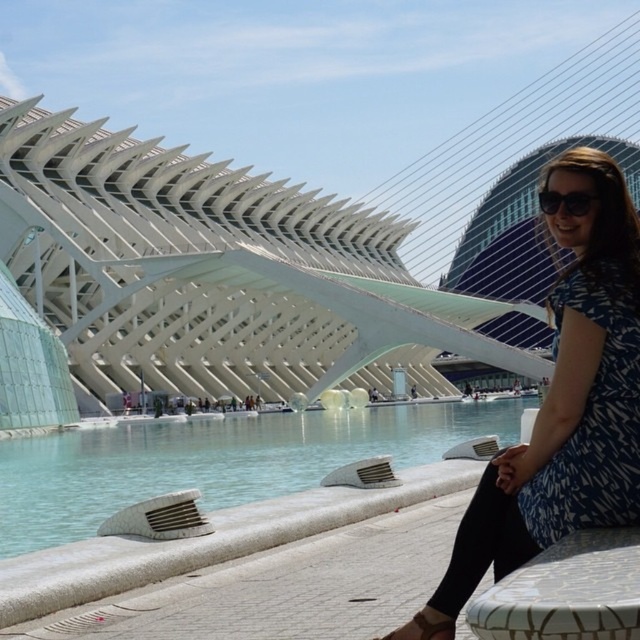
Question: Is blue printed dress at center smaller than brown leather sandal at lower center?

Choices:
 (A) yes
 (B) no

Answer: (B)

Question: Which object appears closest to the camera in this image?

Choices:
 (A) brown leather sandal at lower center
 (B) white textured ledge at lower center

Answer: (A)

Question: Can you confirm if white textured ledge at lower center is wider than brown leather sandal at lower center?

Choices:
 (A) no
 (B) yes

Answer: (B)

Question: Which point is farther to the camera?

Choices:
 (A) brown leather sandal at lower center
 (B) blue printed dress at center
 (C) blue printed dress at lower right
 (D) white textured ledge at lower center

Answer: (D)

Question: Does blue printed dress at center appear over brown leather sandal at lower center?

Choices:
 (A) no
 (B) yes

Answer: (B)

Question: Based on their relative distances, which object is nearer to the brown leather sandal at lower center?

Choices:
 (A) blue printed dress at center
 (B) blue printed dress at lower right

Answer: (A)